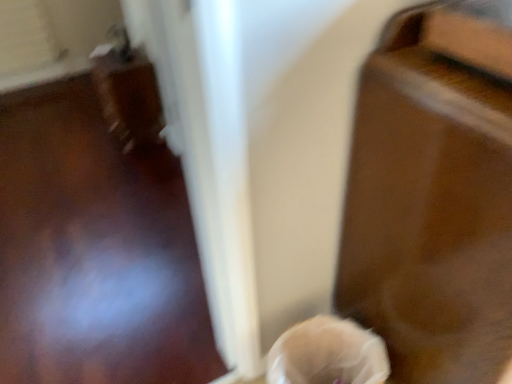
Question: Considering the positions of translucent plastic bag at lower center and glossy wood table at right in the image, is translucent plastic bag at lower center wider or thinner than glossy wood table at right?

Choices:
 (A) wide
 (B) thin

Answer: (B)

Question: Is translucent plastic bag at lower center taller or shorter than glossy wood table at right?

Choices:
 (A) short
 (B) tall

Answer: (A)

Question: From a real-world perspective, relative to glossy wood table at right, is translucent plastic bag at lower center vertically above or below?

Choices:
 (A) below
 (B) above

Answer: (A)

Question: Considering the relative positions of glossy wood table at right and translucent plastic bag at lower center in the image provided, is glossy wood table at right to the left or to the right of translucent plastic bag at lower center?

Choices:
 (A) right
 (B) left

Answer: (A)

Question: Looking at the image, does glossy wood table at right seem bigger or smaller compared to translucent plastic bag at lower center?

Choices:
 (A) small
 (B) big

Answer: (B)

Question: In terms of height, does glossy wood table at right look taller or shorter compared to translucent plastic bag at lower center?

Choices:
 (A) tall
 (B) short

Answer: (A)

Question: Which is correct: glossy wood table at right is inside translucent plastic bag at lower center, or outside of it?

Choices:
 (A) outside
 (B) inside

Answer: (A)